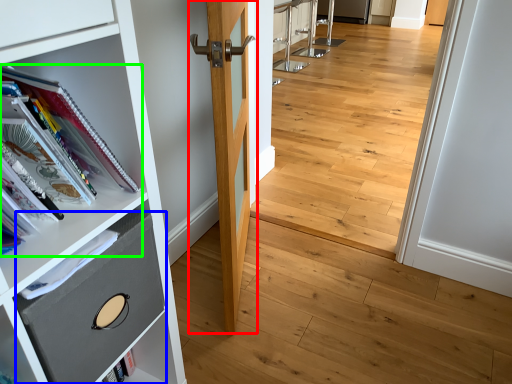
Question: Which is nearer to the door (highlighted by a red box)? drawer (highlighted by a blue box) or book (highlighted by a green box).

Choices:
 (A) drawer
 (B) book

Answer: (B)